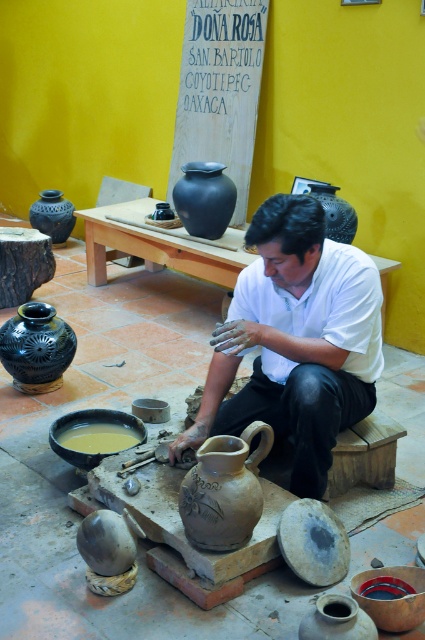
Who is more forward, (62, 221) or (323, 189)?

Positioned in front is point (323, 189).

Measure the distance between matte black vase at left and camera.

matte black vase at left and camera are 5.26 meters apart.

Is point (50, 211) in front of point (345, 243)?

No.

What are the coordinates of `matte black vase at left` in the screenshot? It's located at point(53,216).

Which is below, black matte vase at left or matte black vase at center?

Positioned lower is black matte vase at left.

Can you confirm if black matte vase at left is wider than matte black vase at center?

In fact, black matte vase at left might be narrower than matte black vase at center.

This screenshot has width=425, height=640. I want to click on black matte vase at left, so click(x=36, y=348).

Is matte black vase at center to the right of matte black vase at left from the viewer's perspective?

Yes, matte black vase at center is to the right of matte black vase at left.

Which is below, matte black vase at center or matte black vase at left?

Positioned lower is matte black vase at center.

Describe the element at coordinates (204, 198) in the screenshot. I see `matte black vase at center` at that location.

I want to click on matte black vase at center, so click(204, 198).